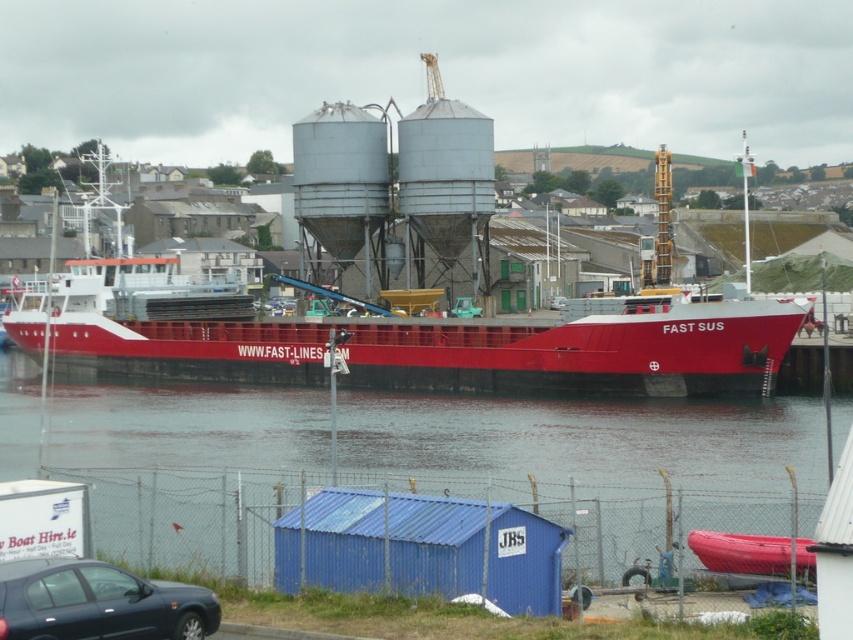
You are a photographer planning to capture the entire scene of the maritime port. You notice the smooth water at center and the matte black car at lower left. Which object should you focus on to ensure the wider subject is properly framed?

The smooth water at center should be focused on because its width surpasses that of the matte black car at lower left, making it the wider subject in the scene.